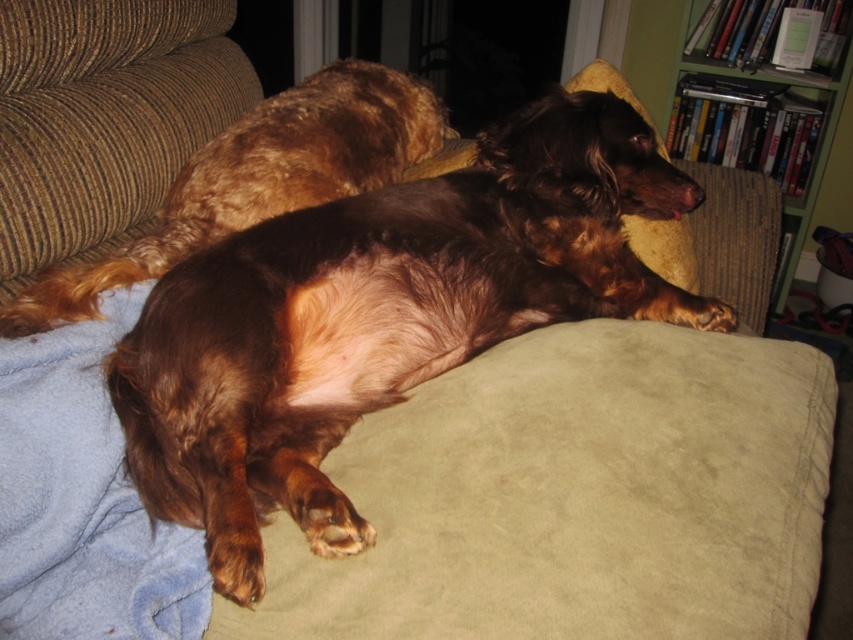
Question: Does blue fleece blanket at lower left have a lesser width compared to green wood bookshelf at upper right?

Choices:
 (A) no
 (B) yes

Answer: (B)

Question: Which point is closer to the camera?

Choices:
 (A) (102, 378)
 (B) (352, 113)
 (C) (306, 500)
 (D) (784, 76)

Answer: (C)

Question: Is brown shaggy dog at center smaller than green wood bookshelf at upper right?

Choices:
 (A) yes
 (B) no

Answer: (B)

Question: Can you confirm if blue fleece blanket at lower left is bigger than shiny brown fur at center?

Choices:
 (A) no
 (B) yes

Answer: (A)

Question: Which point is closer to the camera?

Choices:
 (A) (279, 138)
 (B) (413, 353)
 (C) (128, 598)

Answer: (C)

Question: Which of the following is the farthest from the observer?

Choices:
 (A) shiny brown fur at center
 (B) green wood bookshelf at upper right
 (C) brown shaggy dog at center

Answer: (B)